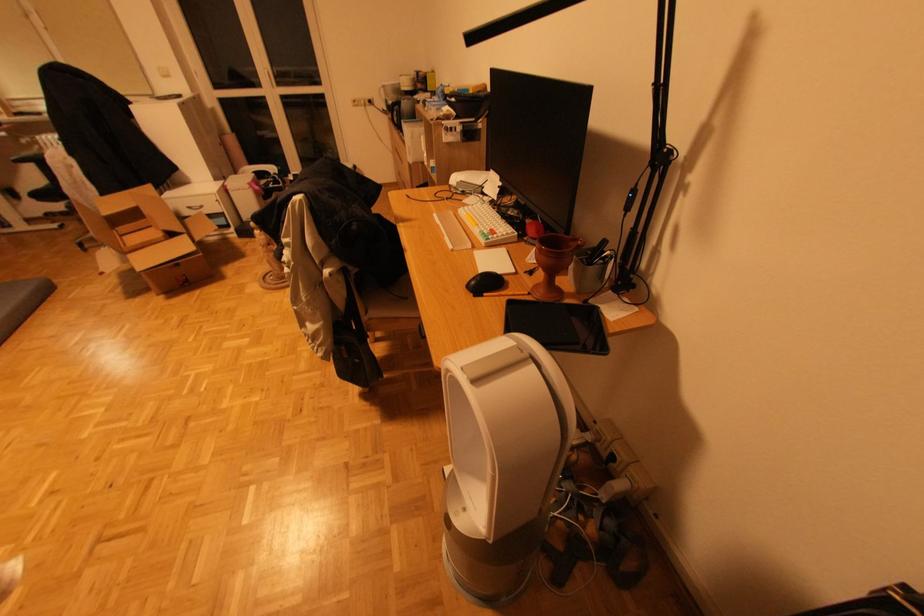
Where would you lift the white fan handle? Please return your answer as a coordinate pair (x, y).

(494, 362)